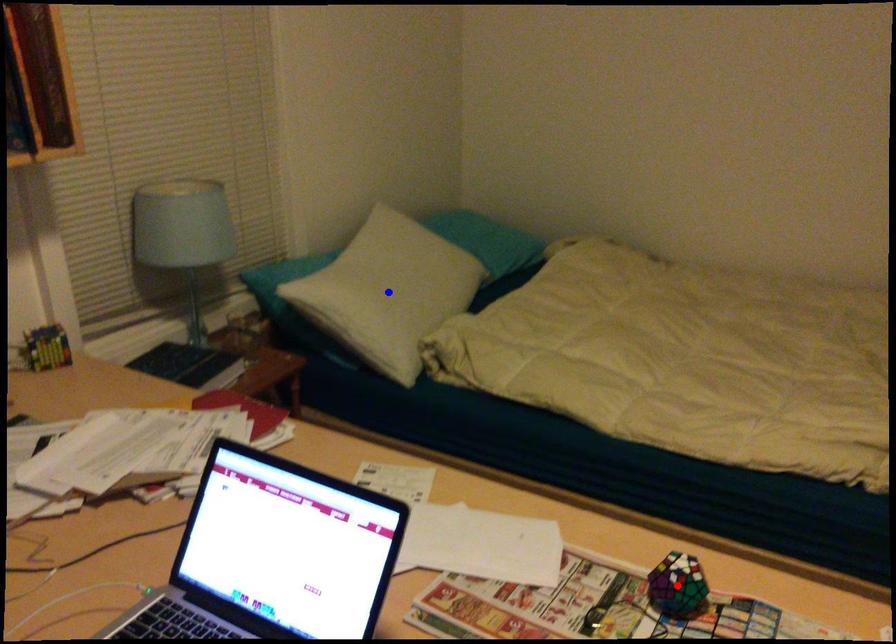
Question: Two points are marked on the image. Which point is closer to the camera?

Choices:
 (A) Blue point is closer.
 (B) Red point is closer.

Answer: (B)